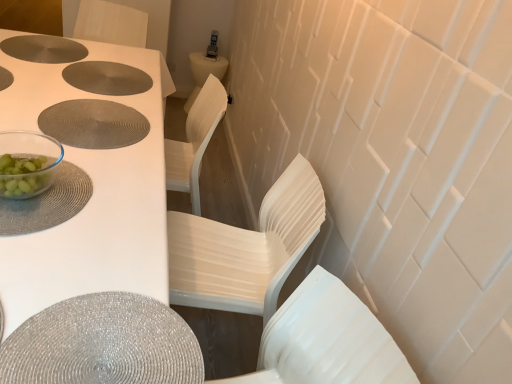
Where is `vacant space behind matte silver placemat at center, which ranks as the first hole in bottom-to-top order`? vacant space behind matte silver placemat at center, which ranks as the first hole in bottom-to-top order is located at coordinates (104, 81).